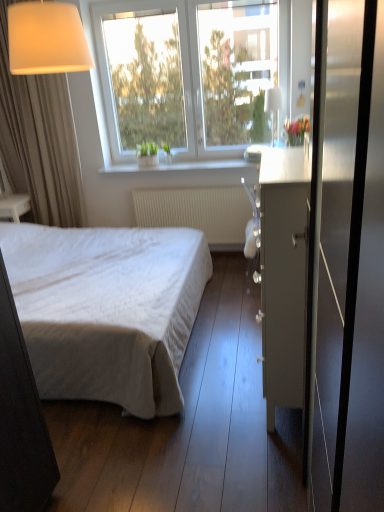
In order to click on vacant region to the left of matte gray cabinet at center-right in this screenshot , I will do `click(195, 406)`.